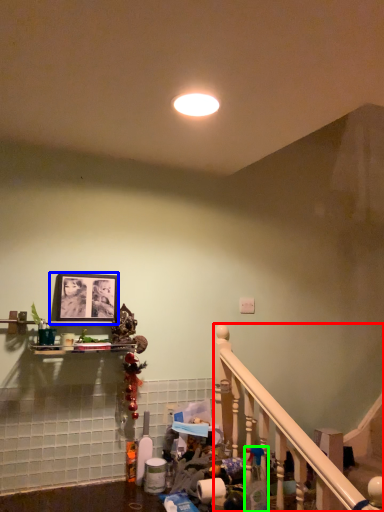
Question: Considering the real-world distances, which object is farthest from rail (highlighted by a red box)? picture frame (highlighted by a blue box) or cleaning product (highlighted by a green box)?

Choices:
 (A) picture frame
 (B) cleaning product

Answer: (A)